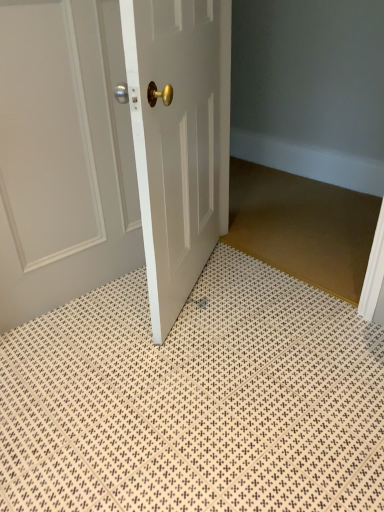
Question: From a real-world perspective, is white glossy door at center, the 2th door in the left-to-right sequence, positioned under brown textured mat at center based on gravity?

Choices:
 (A) no
 (B) yes

Answer: (A)

Question: Is white glossy door at center, which is the first door in right-to-left order, looking in the opposite direction of brown textured mat at center?

Choices:
 (A) yes
 (B) no

Answer: (B)

Question: Considering the relative sizes of white glossy door at center, which is the first door in right-to-left order, and brown textured mat at center in the image provided, is white glossy door at center, which is the first door in right-to-left order, smaller than brown textured mat at center?

Choices:
 (A) yes
 (B) no

Answer: (B)

Question: Is white glossy door at center, which is the first door in right-to-left order, at the right side of brown textured mat at center?

Choices:
 (A) no
 (B) yes

Answer: (A)

Question: Is white glossy door at center, the 2th door in the left-to-right sequence, beside brown textured mat at center?

Choices:
 (A) yes
 (B) no

Answer: (B)

Question: Looking at the image, does white glossy door at center, which is the first door in right-to-left order, seem bigger or smaller compared to brown textured mat at center?

Choices:
 (A) small
 (B) big

Answer: (B)

Question: Considering the positions of white glossy door at center, which is the first door in right-to-left order, and brown textured mat at center in the image, is white glossy door at center, which is the first door in right-to-left order, taller or shorter than brown textured mat at center?

Choices:
 (A) short
 (B) tall

Answer: (B)

Question: From a real-world perspective, is white glossy door at center, which is the first door in right-to-left order, physically located above or below brown textured mat at center?

Choices:
 (A) below
 (B) above

Answer: (B)

Question: Visually, is white glossy door at center, which is the first door in right-to-left order, positioned to the left or to the right of brown textured mat at center?

Choices:
 (A) right
 (B) left

Answer: (B)

Question: Is point (264, 194) positioned closer to the camera than point (215, 348)?

Choices:
 (A) farther
 (B) closer

Answer: (A)

Question: Relative to white textured bath mat at center, is brown textured mat at center in front or behind?

Choices:
 (A) behind
 (B) front

Answer: (A)

Question: In terms of width, does brown textured mat at center look wider or thinner when compared to white textured bath mat at center?

Choices:
 (A) wide
 (B) thin

Answer: (B)

Question: Is brown textured mat at center inside or outside of white textured bath mat at center?

Choices:
 (A) inside
 (B) outside

Answer: (B)

Question: From the image's perspective, is white glossy door at upper left, which ranks as the second door in right-to-left order, located above or below brown textured mat at center?

Choices:
 (A) above
 (B) below

Answer: (A)

Question: In terms of width, does white glossy door at upper left, which ranks as the second door in right-to-left order, look wider or thinner when compared to brown textured mat at center?

Choices:
 (A) wide
 (B) thin

Answer: (B)